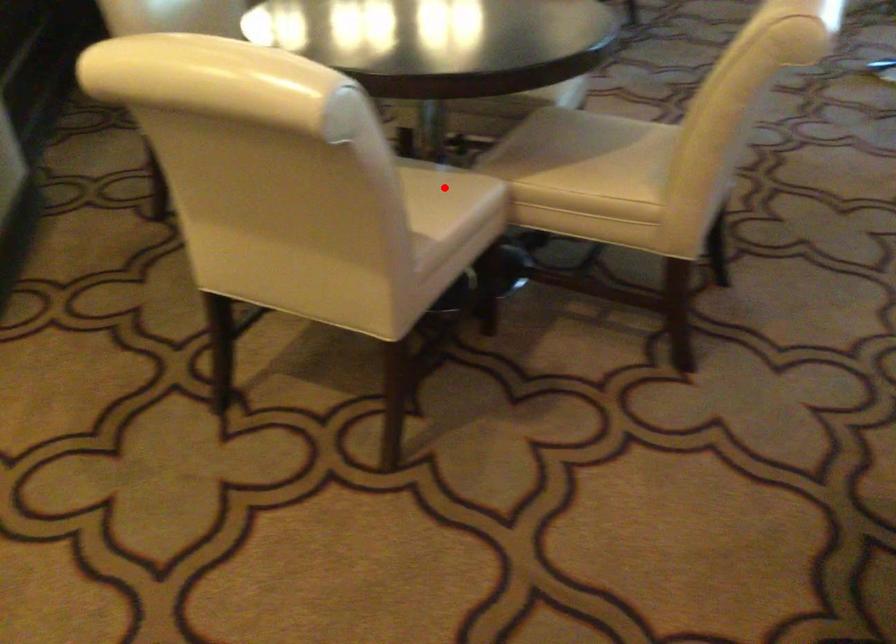
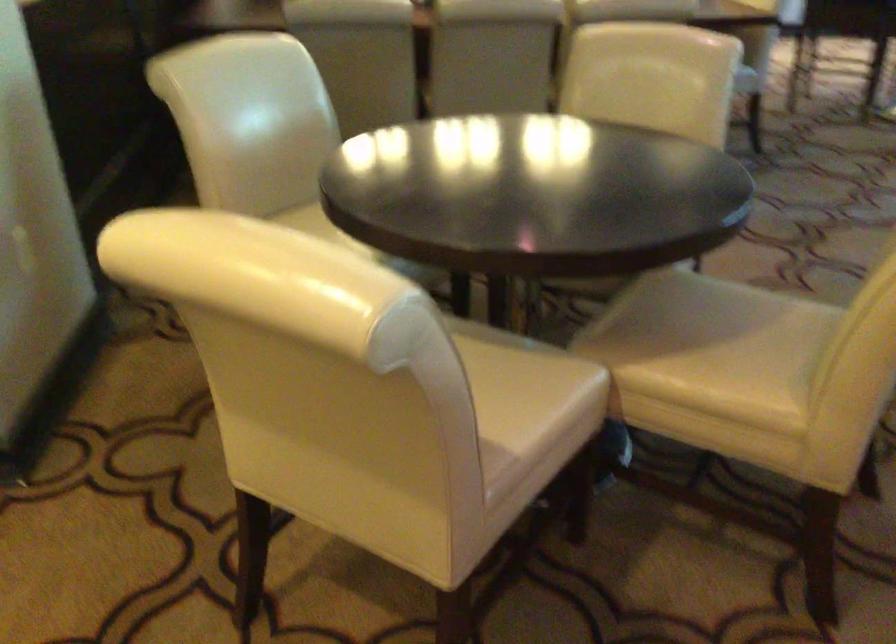
Locate, in the second image, the point that corresponds to the highlighted location in the first image.

(530, 377)